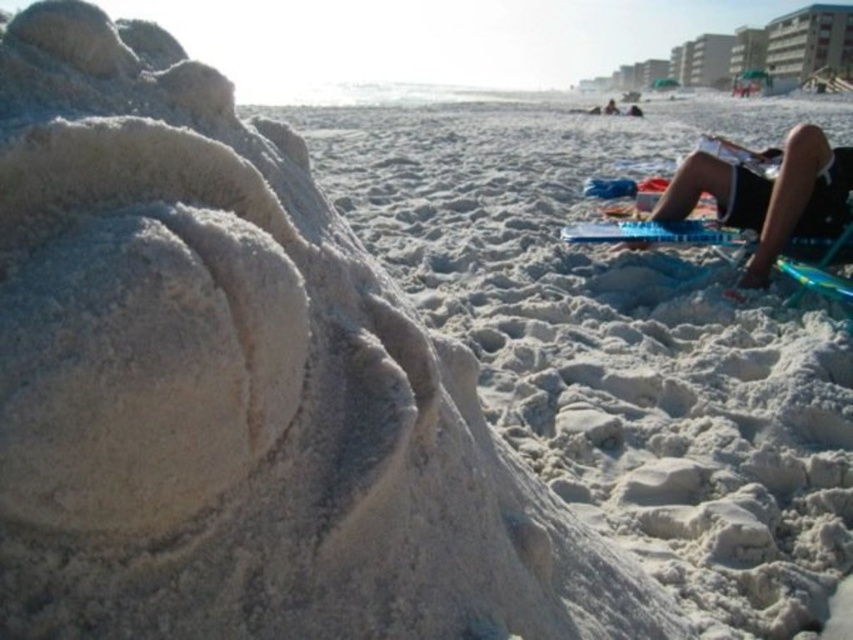
You are standing at the center of the beach and want to find the white sandcastle at left. According to the coordinates provided, in which direction should you walk to reach it?

The white sandcastle at left is located at coordinates point (619, 340). Since you are at the center, you should walk towards the left side of the beach to reach it.

You are standing at the camera position observing the beach scene. There are two points marked on the image, point A at coordinates point A is point (561, 397) and point B at coordinates point B is point (659, 204). Which point is nearer to you?

Point A at coordinates point A is point (561, 397) is closer to the camera than point B at coordinates point B is point (659, 204), so point A is nearer to you.

You are a photographer standing at the center of the beach scene. You want to capture a photo that includes both the white sandcastle at left and the black fabric shorts at upper right. Which direction should you move to ensure both objects are in your frame?

You should move to the left because the white sandcastle at left is to the left of the black fabric shorts at upper right. By moving left, you can position yourself to include both objects in your frame.